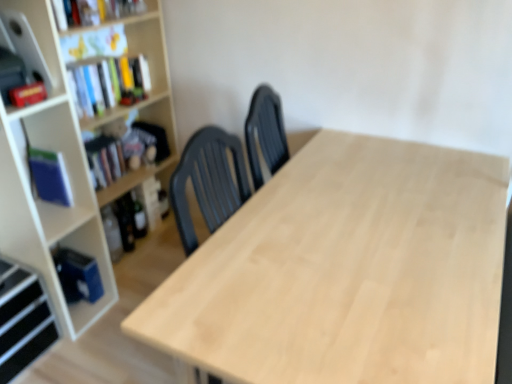
Question: Is blue matte book at left, which is the third book in top-to-bottom order, a part of wooden bookshelf at upper left, the 2th shelf in the bottom-to-top sequence?

Choices:
 (A) yes
 (B) no

Answer: (B)

Question: Is wooden bookshelf at upper left, the first shelf from the top, positioned behind blue matte book at left, arranged as the first book when ordered from the bottom?

Choices:
 (A) yes
 (B) no

Answer: (B)

Question: Is wooden bookshelf at upper left, the 2th shelf in the bottom-to-top sequence, in front of blue matte book at left, arranged as the first book when ordered from the bottom?

Choices:
 (A) yes
 (B) no

Answer: (A)

Question: Does wooden bookshelf at upper left, which is the second shelf from left to right, have a greater height compared to blue matte book at left, which is the third book in top-to-bottom order?

Choices:
 (A) yes
 (B) no

Answer: (B)

Question: Can you confirm if wooden bookshelf at upper left, which is the second shelf from left to right, is wider than blue matte book at left, arranged as the first book when ordered from the bottom?

Choices:
 (A) no
 (B) yes

Answer: (B)

Question: Is blue matte book at left, arranged as the first book when ordered from the bottom, at the back of wooden bookshelf at upper left, the first shelf from the top?

Choices:
 (A) no
 (B) yes

Answer: (A)

Question: Is black plastic shelf at lower left, which is the first shelf in left-to-right order, with wooden bookshelf at upper left, the 2th shelf in the bottom-to-top sequence?

Choices:
 (A) no
 (B) yes

Answer: (A)

Question: Considering the relative positions of black plastic shelf at lower left, which is the first shelf from bottom to top, and wooden bookshelf at upper left, which is the second shelf from left to right, in the image provided, is black plastic shelf at lower left, which is the first shelf from bottom to top, to the left of wooden bookshelf at upper left, which is the second shelf from left to right, from the viewer's perspective?

Choices:
 (A) yes
 (B) no

Answer: (A)

Question: Could you tell me if black plastic shelf at lower left, which ranks as the second shelf in right-to-left order, is turned towards wooden bookshelf at upper left, the first shelf from the top?

Choices:
 (A) no
 (B) yes

Answer: (A)

Question: From the image's perspective, does black plastic shelf at lower left, placed as the 2th shelf when sorted from top to bottom, appear higher than wooden bookshelf at upper left, which is the second shelf from left to right?

Choices:
 (A) no
 (B) yes

Answer: (A)

Question: From a real-world perspective, is black plastic shelf at lower left, which is the first shelf from bottom to top, physically above wooden bookshelf at upper left, which is the second shelf from left to right?

Choices:
 (A) no
 (B) yes

Answer: (A)

Question: Is wooden bookshelf at upper left, the first shelf positioned from the right, at the back of black plastic shelf at lower left, which ranks as the second shelf in right-to-left order?

Choices:
 (A) yes
 (B) no

Answer: (B)

Question: Are hardcover book at left, the second book ordered from the bottom, and blue matte book at left, which is the third book in top-to-bottom order, beside each other?

Choices:
 (A) no
 (B) yes

Answer: (A)